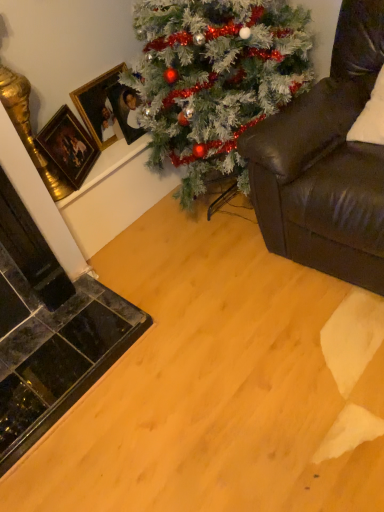
Question: Is green matte christmas tree at upper center outside of leather couch at right?

Choices:
 (A) yes
 (B) no

Answer: (A)

Question: From the image's perspective, is green matte christmas tree at upper center on top of leather couch at right?

Choices:
 (A) yes
 (B) no

Answer: (A)

Question: Is green matte christmas tree at upper center turned away from leather couch at right?

Choices:
 (A) no
 (B) yes

Answer: (A)

Question: Can you confirm if green matte christmas tree at upper center is positioned to the left of leather couch at right?

Choices:
 (A) no
 (B) yes

Answer: (B)

Question: Considering the relative positions of green matte christmas tree at upper center and leather couch at right in the image provided, is green matte christmas tree at upper center in front of leather couch at right?

Choices:
 (A) no
 (B) yes

Answer: (A)

Question: In the image, is gold-framed picture at upper left, which appears as the first picture frame when viewed from the right, on the left side or the right side of green matte christmas tree at upper center?

Choices:
 (A) left
 (B) right

Answer: (A)

Question: From their relative heights in the image, would you say gold-framed picture at upper left, which appears as the first picture frame when viewed from the right, is taller or shorter than green matte christmas tree at upper center?

Choices:
 (A) short
 (B) tall

Answer: (A)

Question: Is gold-framed picture at upper left, the 3th picture frame positioned from the left, inside the boundaries of green matte christmas tree at upper center, or outside?

Choices:
 (A) inside
 (B) outside

Answer: (B)

Question: From the image's perspective, relative to green matte christmas tree at upper center, is gold-framed picture at upper left, the 3th picture frame positioned from the left, above or below?

Choices:
 (A) above
 (B) below

Answer: (A)

Question: Considering the positions of gold/gilded picture frame at upper left, the third picture frame in the right-to-left sequence, and leather couch at right in the image, is gold/gilded picture frame at upper left, the third picture frame in the right-to-left sequence, wider or thinner than leather couch at right?

Choices:
 (A) wide
 (B) thin

Answer: (B)

Question: From the image's perspective, is gold/gilded picture frame at upper left, which is counted as the 1th picture frame, starting from the left, positioned above or below leather couch at right?

Choices:
 (A) above
 (B) below

Answer: (B)

Question: Relative to leather couch at right, is gold/gilded picture frame at upper left, the third picture frame in the right-to-left sequence, in front or behind?

Choices:
 (A) behind
 (B) front

Answer: (A)

Question: Based on their sizes in the image, would you say gold/gilded picture frame at upper left, which is counted as the 1th picture frame, starting from the left, is bigger or smaller than leather couch at right?

Choices:
 (A) big
 (B) small

Answer: (B)

Question: From the image's perspective, relative to gold-framed picture at upper left, the 3th picture frame positioned from the left, is green matte christmas tree at upper center above or below?

Choices:
 (A) below
 (B) above

Answer: (A)

Question: In the image, is green matte christmas tree at upper center positioned in front of or behind gold-framed picture at upper left, which appears as the first picture frame when viewed from the right?

Choices:
 (A) behind
 (B) front

Answer: (B)